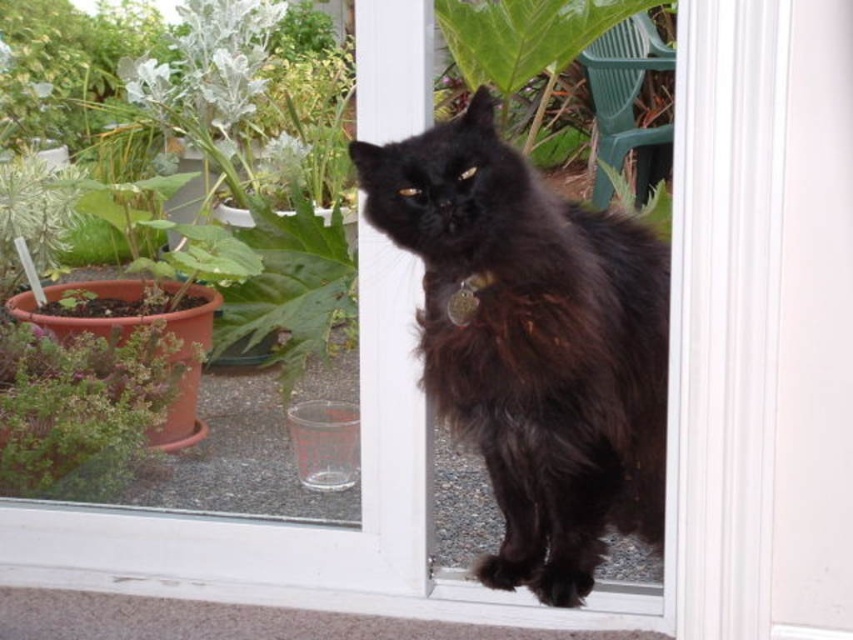
Question: Estimate the real-world distances between objects in this image. Which object is closer to the white smooth screen door at center?

Choices:
 (A) black fluffy cat at center
 (B) green matte plant at left

Answer: (A)

Question: Is white smooth screen door at center to the left of green matte plant at left from the viewer's perspective?

Choices:
 (A) yes
 (B) no

Answer: (B)

Question: Which point is farther from the camera taking this photo?

Choices:
 (A) (635, 324)
 (B) (706, 621)
 (C) (71, 353)

Answer: (C)

Question: Which object appears closest to the camera in this image?

Choices:
 (A) white smooth screen door at center
 (B) green matte plant at left
 (C) black fluffy cat at center

Answer: (A)

Question: Does white smooth screen door at center have a smaller size compared to black fluffy cat at center?

Choices:
 (A) yes
 (B) no

Answer: (A)

Question: Is white smooth screen door at center positioned before green matte plant at left?

Choices:
 (A) no
 (B) yes

Answer: (B)